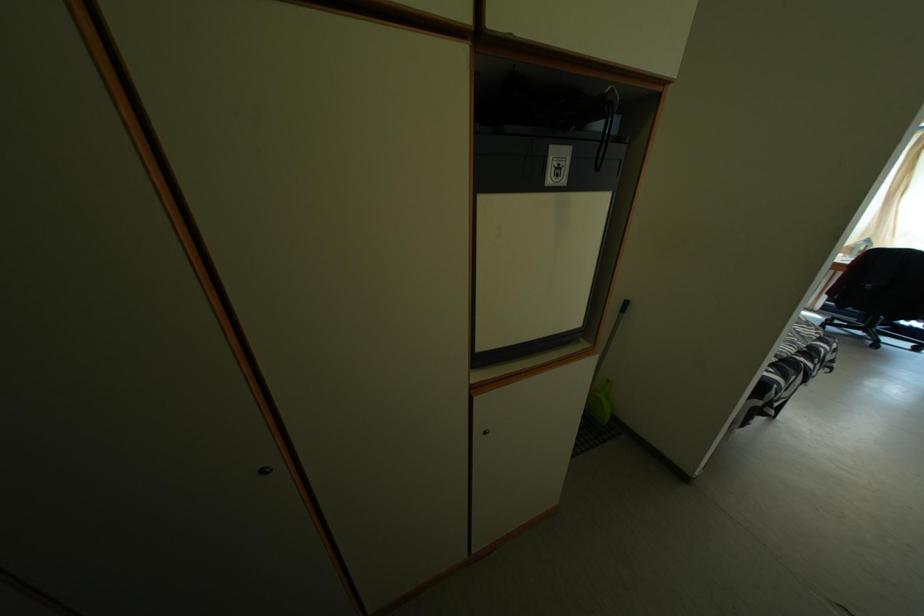
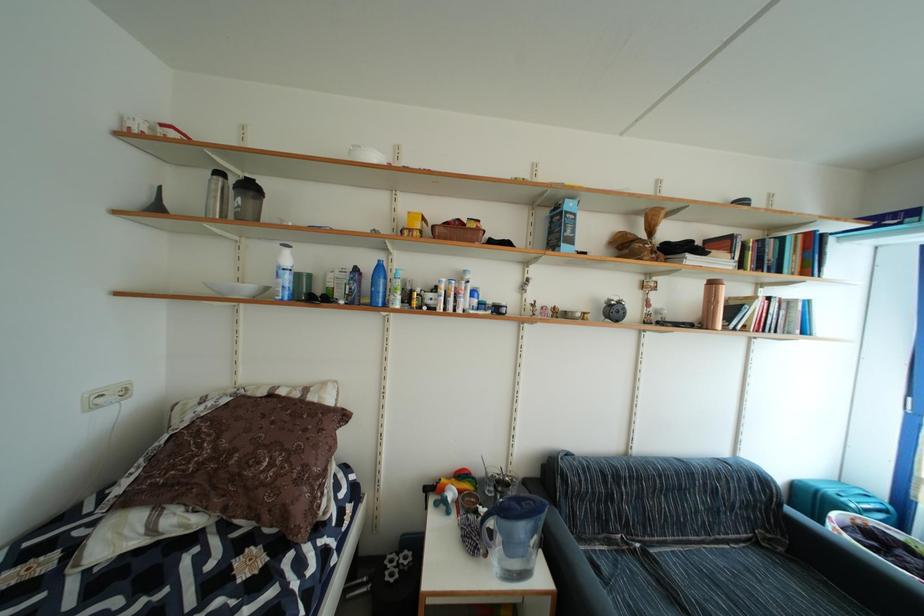
What movement of the cameraman would produce the second image?

The movement direction of the cameraman is right, forward.